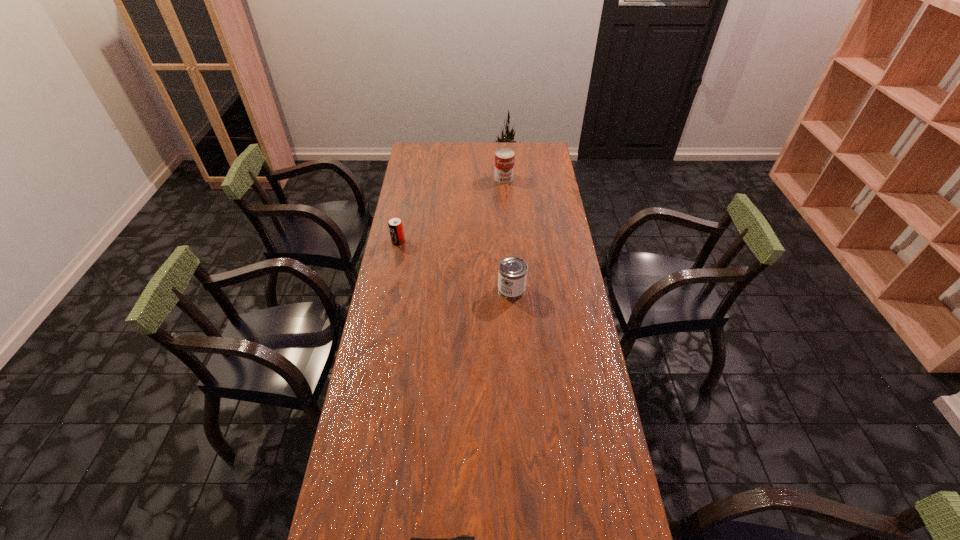
This screenshot has height=540, width=960. What are the coordinates of `the farthest can` in the screenshot? It's located at (504, 158).

Image resolution: width=960 pixels, height=540 pixels. What are the coordinates of `the nearest can` in the screenshot? It's located at (512, 274).

The height and width of the screenshot is (540, 960). In order to click on the second farthest object in this screenshot , I will do `click(395, 225)`.

At what (x,y) coordinates should I click in order to perform the action: click on the leftmost can. Please return your answer as a coordinate pair (x, y). This screenshot has width=960, height=540. Looking at the image, I should click on (395, 225).

Where is `vacant position located 0.320m on the front label of the farthest object`? This screenshot has height=540, width=960. vacant position located 0.320m on the front label of the farthest object is located at coordinates (507, 225).

Locate an element on the screen. The height and width of the screenshot is (540, 960). vacant space located 0.200m on the right of the nearest can is located at coordinates click(x=578, y=289).

You are a GUI agent. You are given a task and a screenshot of the screen. Output one action in this format:
    pyautogui.click(x=<x>, y=<y>)
    Task: Click on the free space located 0.060m on the back of the leftmost can
    
    Given the screenshot: What is the action you would take?
    pyautogui.click(x=400, y=227)

Find the location of a particular element. object situated at the left edge is located at coordinates (395, 225).

Where is `vacant space at the far edge`? vacant space at the far edge is located at coordinates tap(470, 154).

In the image, there is a desktop. What are the coordinates of `free region at the left edge` in the screenshot? It's located at (377, 523).